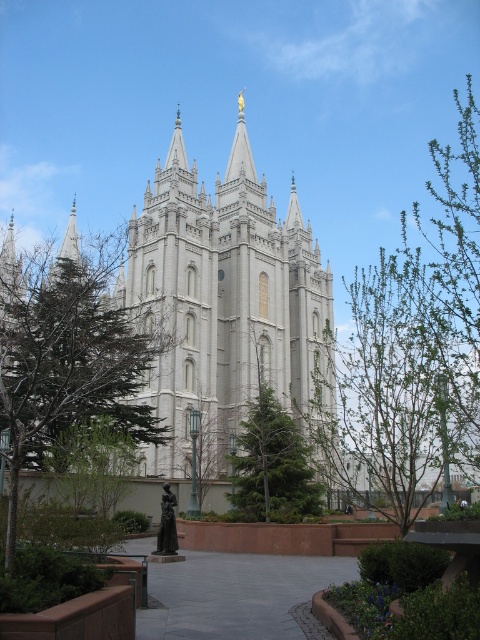
Question: Can you confirm if white stone church at center is smaller than green leafy tree at right?

Choices:
 (A) no
 (B) yes

Answer: (B)

Question: Among these points, which one is farthest from the camera?

Choices:
 (A) (362, 316)
 (B) (39, 346)
 (C) (189, 396)
 (D) (292, 458)

Answer: (A)

Question: Which of the following is the closest to the observer?

Choices:
 (A) (266, 412)
 (B) (437, 170)

Answer: (A)

Question: Which object appears closest to the camera in this image?

Choices:
 (A) green textured tree at center
 (B) white stone church at center
 (C) green leafy tree at lower left

Answer: (C)

Question: Is white stone church at center wider than green textured tree at center?

Choices:
 (A) yes
 (B) no

Answer: (A)

Question: From the image, what is the correct spatial relationship of white stone church at center in relation to green leafy tree at lower left?

Choices:
 (A) left
 (B) right

Answer: (B)